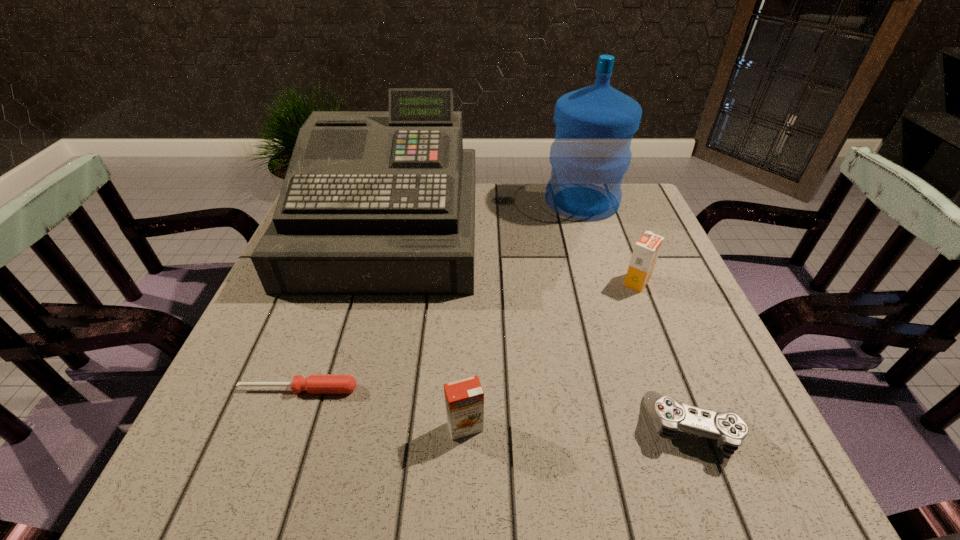
The height and width of the screenshot is (540, 960). Find the location of `control at the right edge`. control at the right edge is located at coordinates [x=668, y=415].

Locate an element on the screen. object located at the far left corner is located at coordinates (373, 202).

Locate an element on the screen. The height and width of the screenshot is (540, 960). object at the far right corner is located at coordinates (591, 152).

Find the location of a particular element. This screenshot has height=540, width=960. object that is at the near right corner is located at coordinates (668, 415).

The width and height of the screenshot is (960, 540). In the image, there is a desktop. In order to click on vacant space at the near edge in this screenshot , I will do `click(423, 460)`.

Identify the location of free location at the left edge. (272, 379).

Locate an element on the screen. blank space at the right edge of the desktop is located at coordinates (685, 350).

Where is `free region at the near left corner of the desktop`? free region at the near left corner of the desktop is located at coordinates (221, 455).

Where is `vacant space at the far right corner`? vacant space at the far right corner is located at coordinates (648, 206).

This screenshot has width=960, height=540. Find the location of `free space between the water jug and the control`. free space between the water jug and the control is located at coordinates (637, 314).